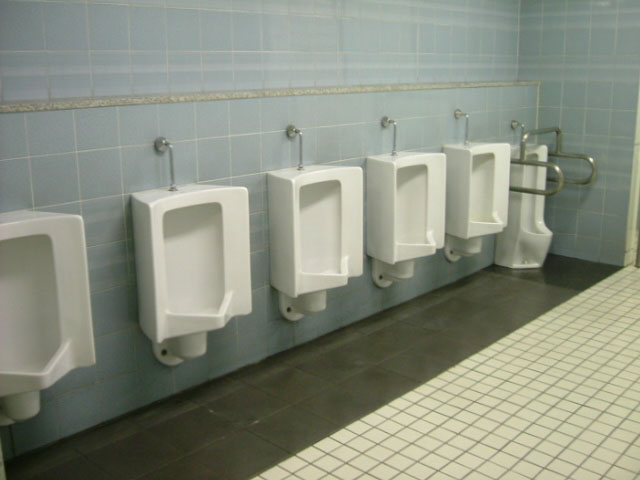
You are a GUI agent. You are given a task and a screenshot of the screen. Output one action in this format:
    pyautogui.click(x=<x>, y=<y>)
    Task: Click on the bathroom urinals
    
    Given the screenshot: What is the action you would take?
    pyautogui.click(x=32, y=300), pyautogui.click(x=192, y=253), pyautogui.click(x=337, y=228), pyautogui.click(x=404, y=204), pyautogui.click(x=483, y=180), pyautogui.click(x=528, y=206)